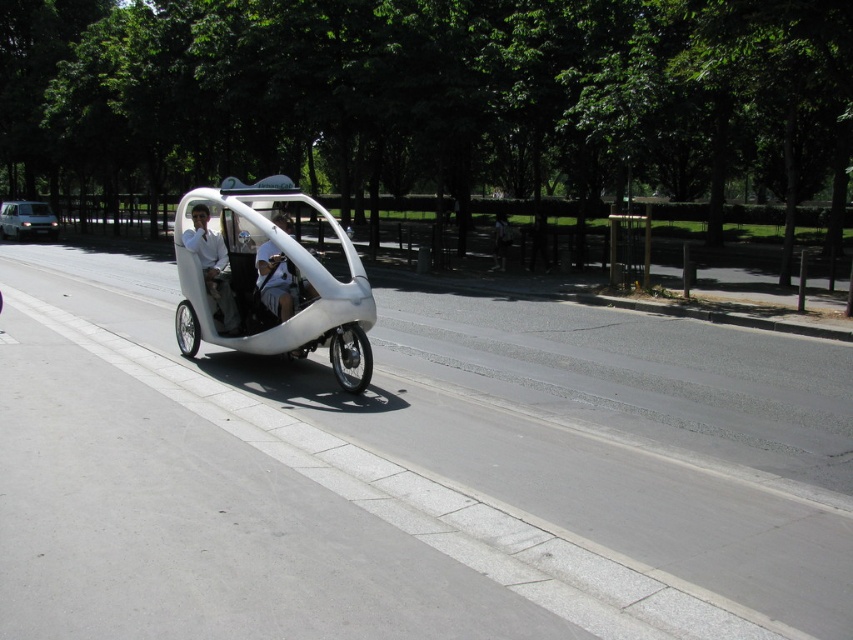
Question: Which of the following is the closest to the observer?

Choices:
 (A) (0, 220)
 (B) (316, 310)

Answer: (B)

Question: Which point is farther to the camera?

Choices:
 (A) white matte sidecar at center
 (B) silver metallic van at left
 (C) white matte helmet at center

Answer: (B)

Question: Does white matte sidecar at center appear on the left side of white matte helmet at center?

Choices:
 (A) yes
 (B) no

Answer: (A)

Question: Does white matte car at center have a larger size compared to silver metallic van at left?

Choices:
 (A) yes
 (B) no

Answer: (A)

Question: From the image, what is the correct spatial relationship of white matte car at center in relation to silver metallic van at left?

Choices:
 (A) below
 (B) above

Answer: (A)

Question: Which of the following is the farthest from the observer?

Choices:
 (A) white matte car at center
 (B) white matte sidecar at center
 (C) silver metallic van at left

Answer: (C)